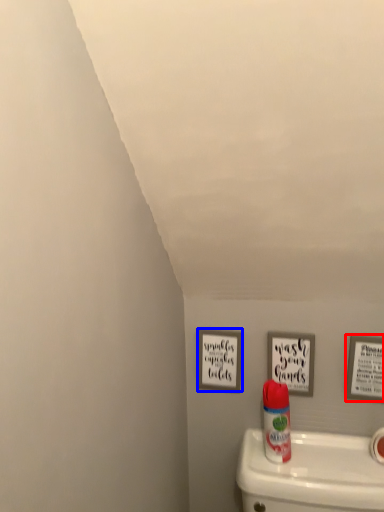
Question: Which object is further to the camera taking this photo, picture frame (highlighted by a red box) or picture frame (highlighted by a blue box)?

Choices:
 (A) picture frame
 (B) picture frame

Answer: (B)